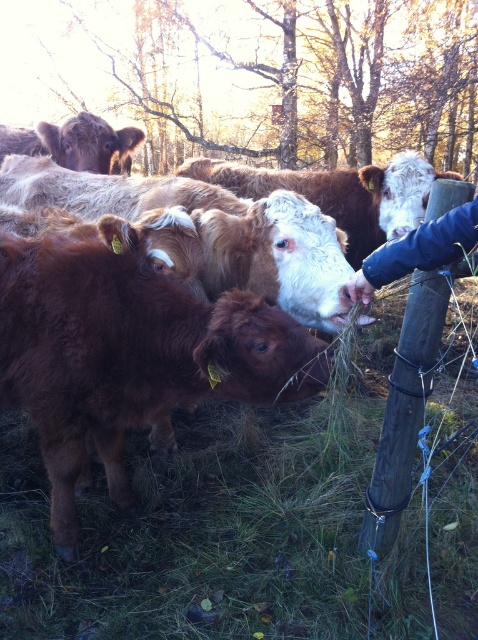
In the scene shown: You are standing in the field and see two points marked in the image. The first point is at coordinates point (352, 291) and the second is at point (14, 138). Which point is closer to you?

Point (352, 291) is in front of point (14, 138), so it is closer to you.

You are a farmer checking the field. You see the brown wooden post at right and the brown woolen cow at upper left. Which object is located lower in the image?

The brown wooden post at right is positioned under the brown woolen cow at upper left, so the post is lower in the image.